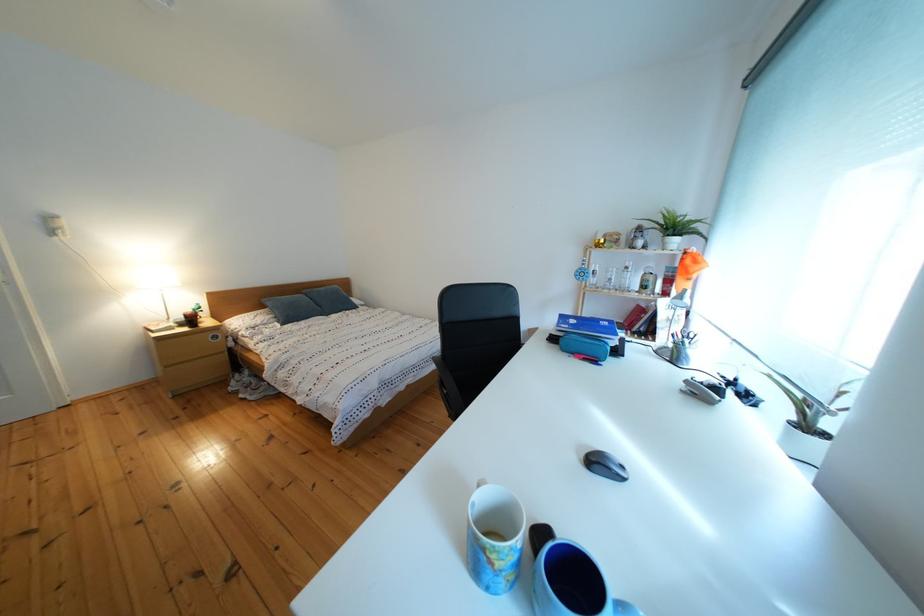
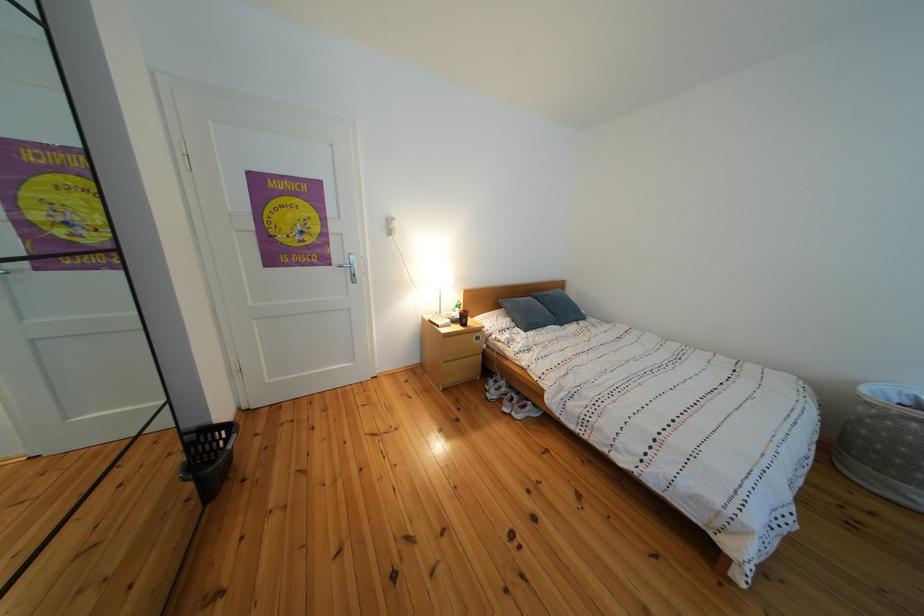
The point at (283, 322) is marked in the first image. Where is the corresponding point in the second image?

(519, 325)